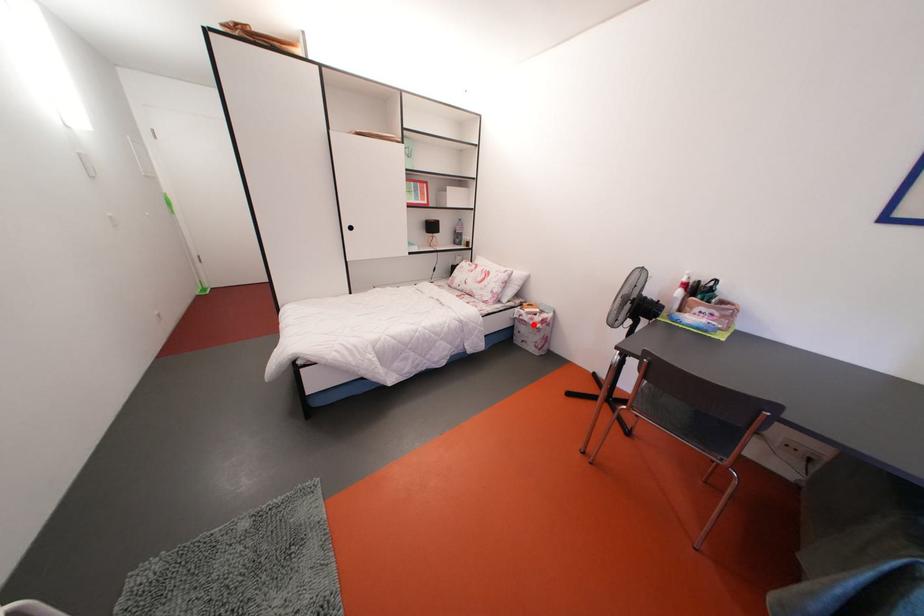
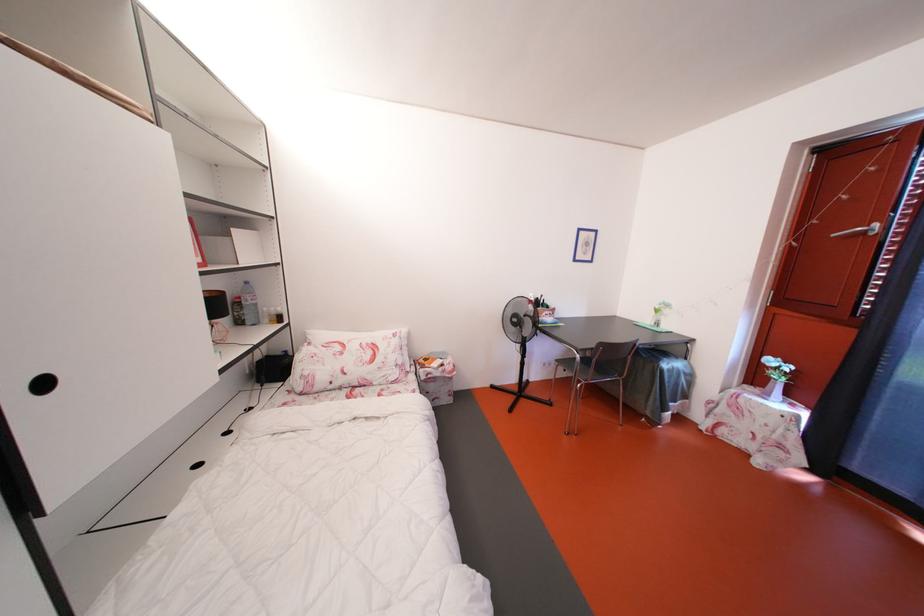
Question: I am providing you with two images of the same scene from different viewpoints. In image1, a red point is highlighted. Considering the same 3D point in image2, which of the following is correct?

Choices:
 (A) It is closer
 (B) It is farther

Answer: (B)